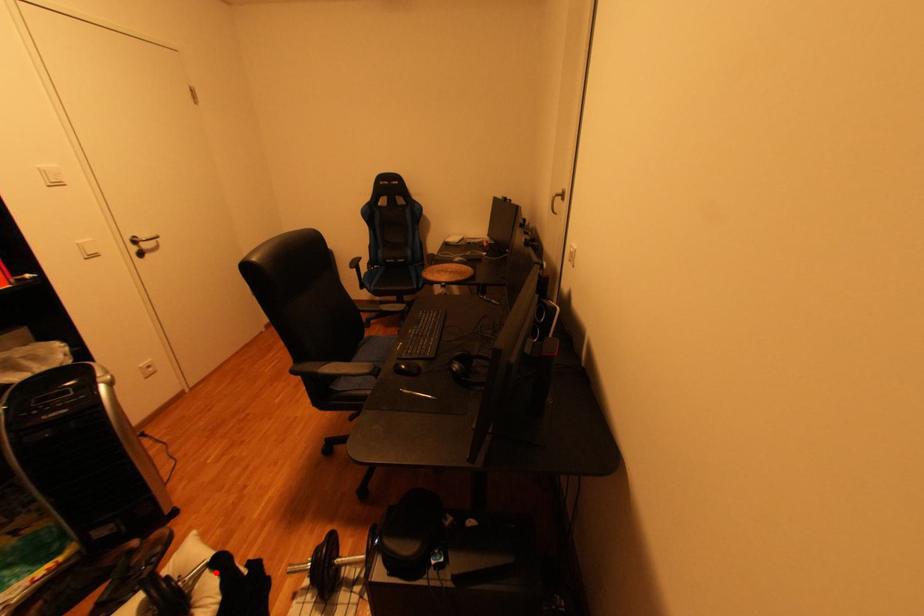
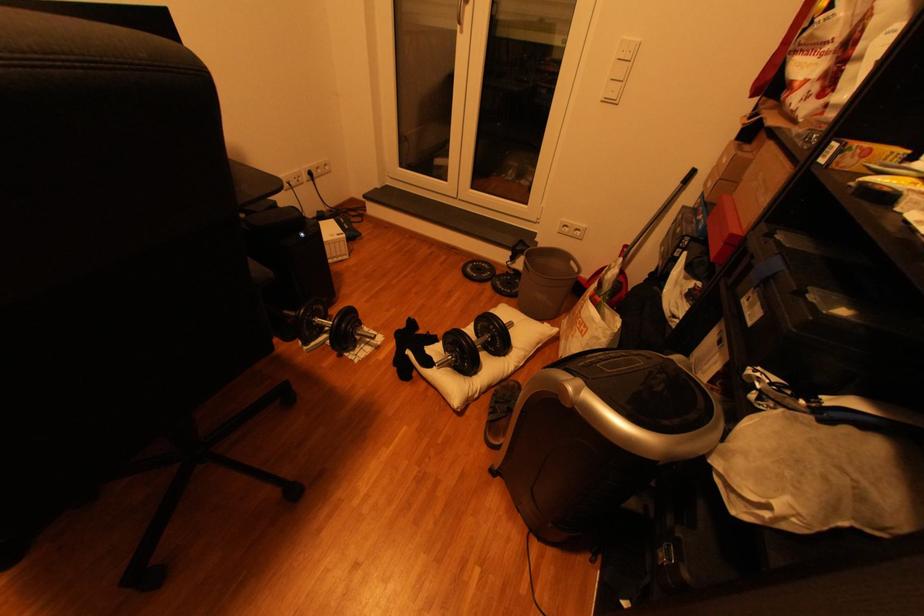
Find the pixel in the second image that matches the highlighted location in the first image.

(445, 361)